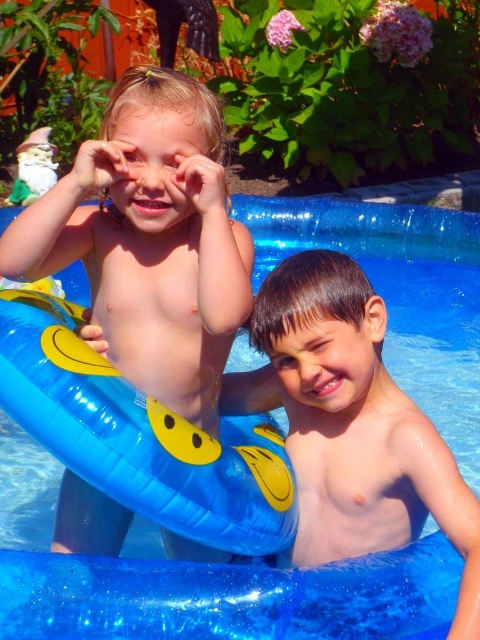
Does matte yellow float at left appear on the left side of smooth skin boy at center?

Yes, matte yellow float at left is to the left of smooth skin boy at center.

Identify the location of matte yellow float at left. The height and width of the screenshot is (640, 480). (149, 241).

Does blue rubber pool at center appear on the right side of smooth skin boy at center?

Correct, you'll find blue rubber pool at center to the right of smooth skin boy at center.

Where is `blue rubber pool at center`? Image resolution: width=480 pixels, height=640 pixels. blue rubber pool at center is located at coordinates (228, 596).

Does point (430, 534) come in front of point (157, 234)?

That is False.

From the picture: Is blue rubber pool at center to the left of matte yellow float at left from the viewer's perspective?

In fact, blue rubber pool at center is to the right of matte yellow float at left.

Between point (8, 609) and point (31, 216), which one is positioned behind?

The point (31, 216) is more distant.

What are the coordinates of `blue rubber pool at center` in the screenshot? It's located at [228, 596].